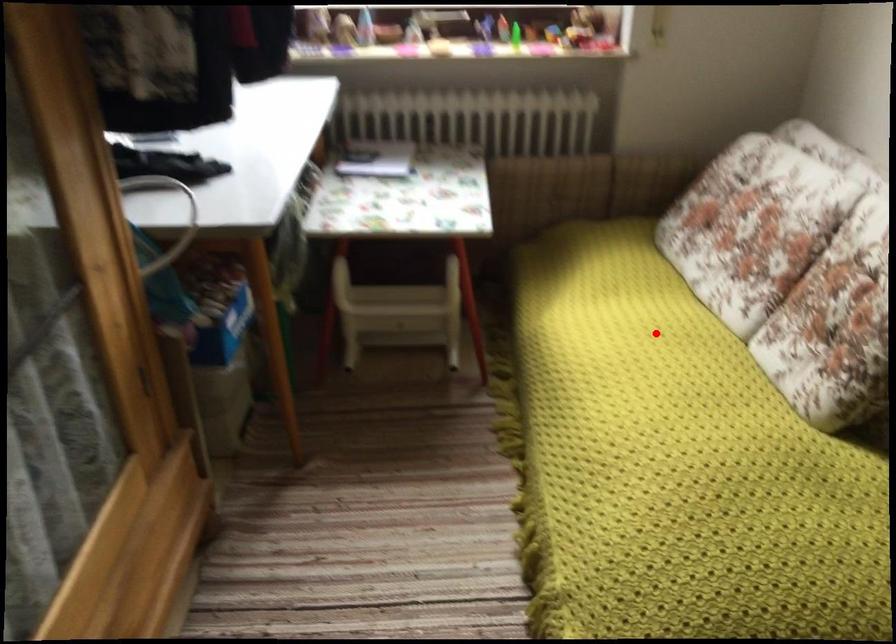
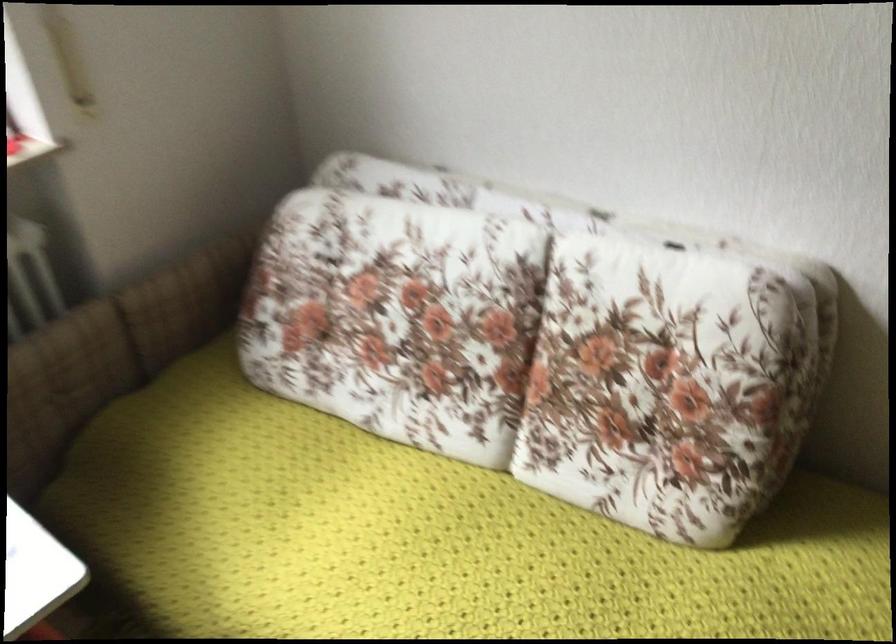
Question: A red point is marked in image1. In image2, is the corresponding 3D point closer to the camera or farther? Reply with the corresponding letter.

Choices:
 (A) The corresponding 3D point is closer.
 (B) The corresponding 3D point is farther.

Answer: (A)